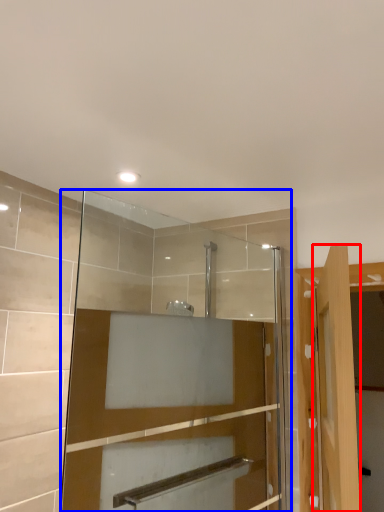
Question: Which object is further to the camera taking this photo, door (highlighted by a red box) or mirror (highlighted by a blue box)?

Choices:
 (A) door
 (B) mirror

Answer: (B)